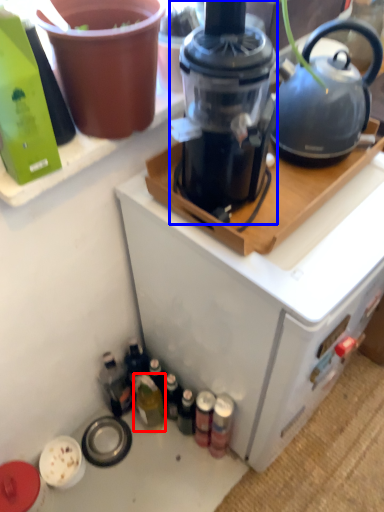
Question: Which of the following is the farthest to the observer, bottle (highlighted by a red box) or blender (highlighted by a blue box)?

Choices:
 (A) bottle
 (B) blender

Answer: (A)